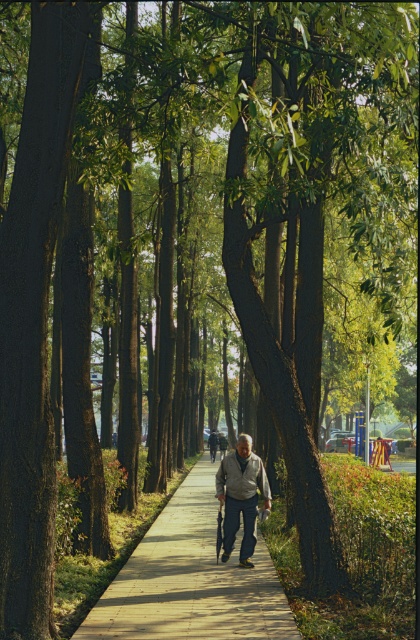
Question: Is wooden boardwalk at center above gray fabric jacket at center?

Choices:
 (A) no
 (B) yes

Answer: (A)

Question: Does wooden boardwalk at center appear over gray fabric jacket at center?

Choices:
 (A) no
 (B) yes

Answer: (A)

Question: Estimate the real-world distances between objects in this image. Which object is closer to the gray fabric jacket at center?

Choices:
 (A) dark gray fabric couple at center
 (B) wooden boardwalk at center

Answer: (B)

Question: Which point appears farthest from the camera in this image?

Choices:
 (A) (267, 589)
 (B) (225, 442)
 (C) (231, 476)

Answer: (B)

Question: Does gray fabric jacket at center appear on the left side of dark gray fabric couple at center?

Choices:
 (A) yes
 (B) no

Answer: (B)

Question: Which point is closer to the camera taking this photo?

Choices:
 (A) (99, 600)
 (B) (220, 440)

Answer: (A)